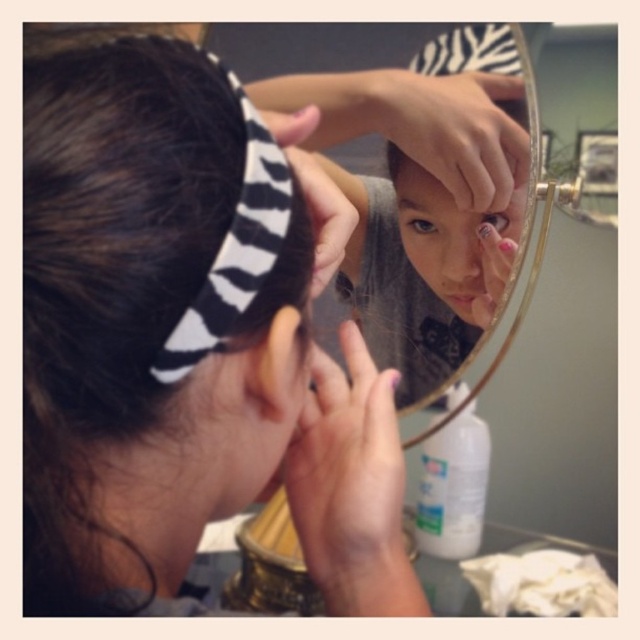
Is black and white striped hair band at upper left closer to the viewer compared to zebra-patterned headband at center?

Yes, black and white striped hair band at upper left is closer to the viewer.

Consider the image. Can you confirm if black and white striped hair band at upper left is taller than zebra-patterned headband at center?

No, black and white striped hair band at upper left is not taller than zebra-patterned headband at center.

This screenshot has width=640, height=640. Describe the element at coordinates (124, 280) in the screenshot. I see `black and white striped hair band at upper left` at that location.

The width and height of the screenshot is (640, 640). In order to click on black and white striped hair band at upper left in this screenshot , I will do `click(124, 280)`.